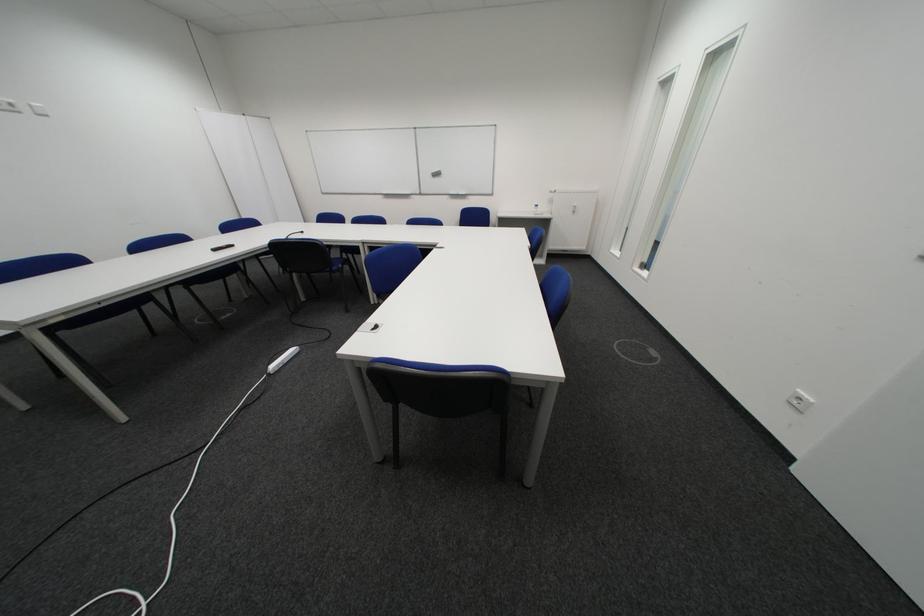
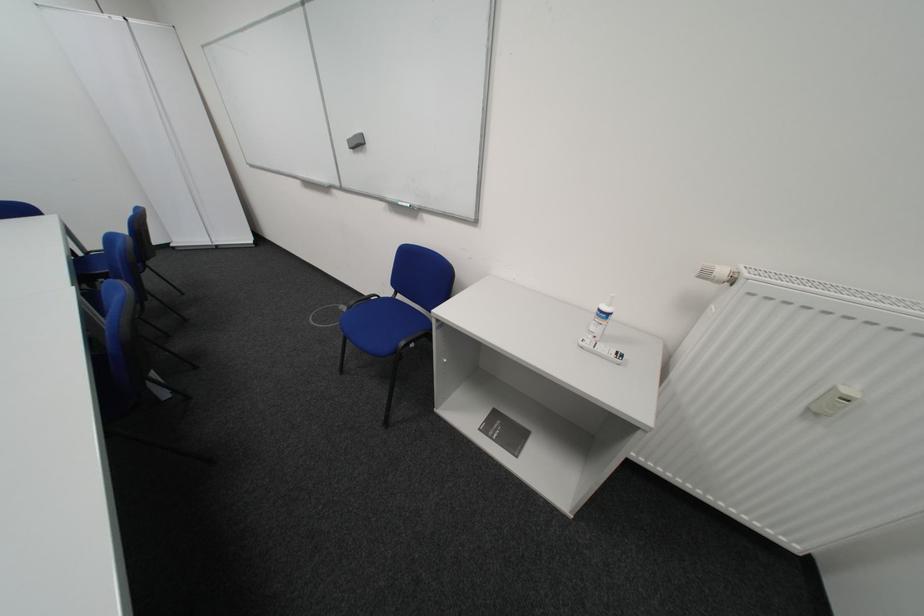
The point at (548, 215) is marked in the first image. Where is the corresponding point in the second image?

(599, 345)